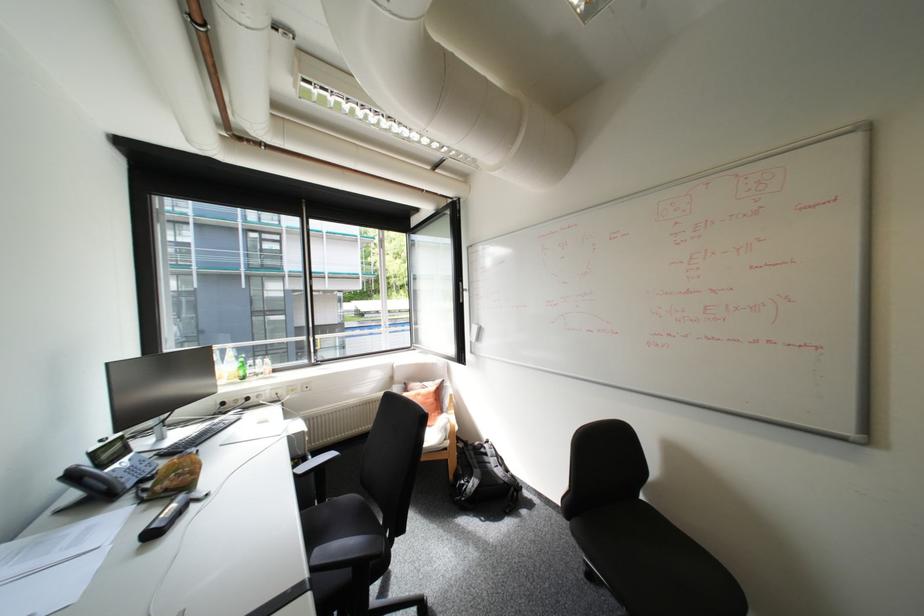
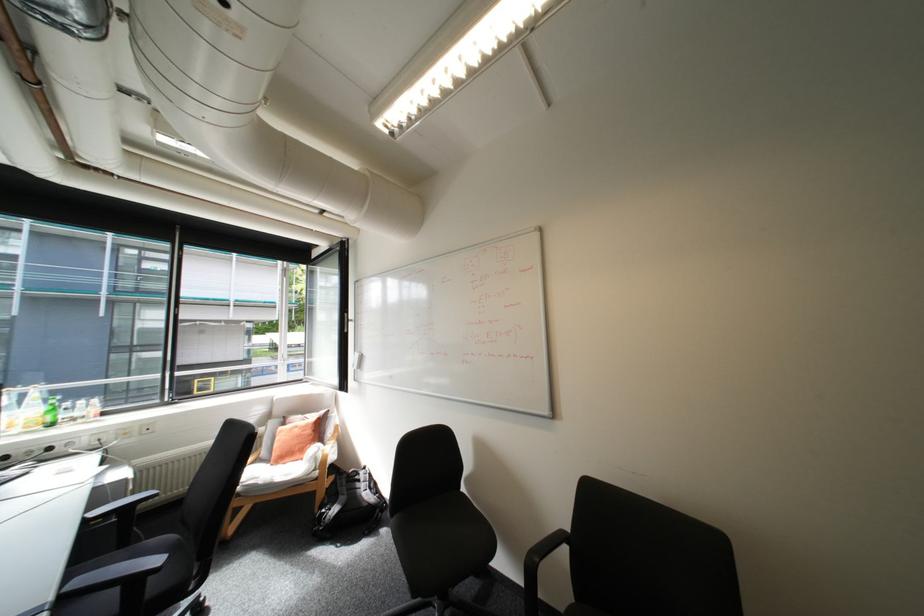
Where in the second image is the point corresponding to pixel 239 379 from the first image?

(38, 427)